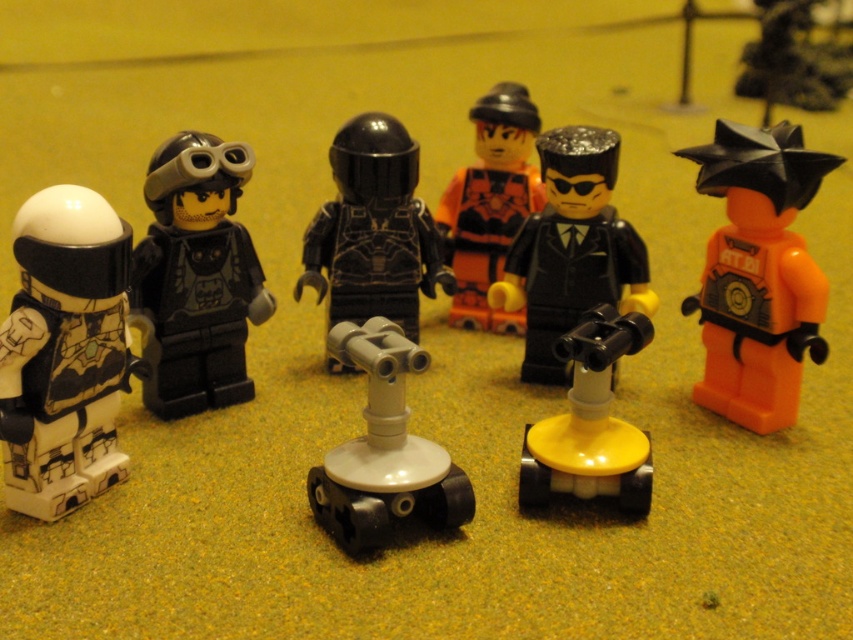
You are standing in front of the LEGO minifigures scene. There are two points marked in the image, one at coordinate point [491,296] and another at point [419,248]. Which point is closer to you?

Point [491,296] is closer to the viewer than point [419,248].

You are a collector who wants to display the shiny black suit at center and the white plastic tripod at center on a shelf. Which object should you place first if you want to arrange them from largest to smallest?

The shiny black suit at center is larger in size than the white plastic tripod at center, so you should place the shiny black suit at center first when arranging from largest to smallest.